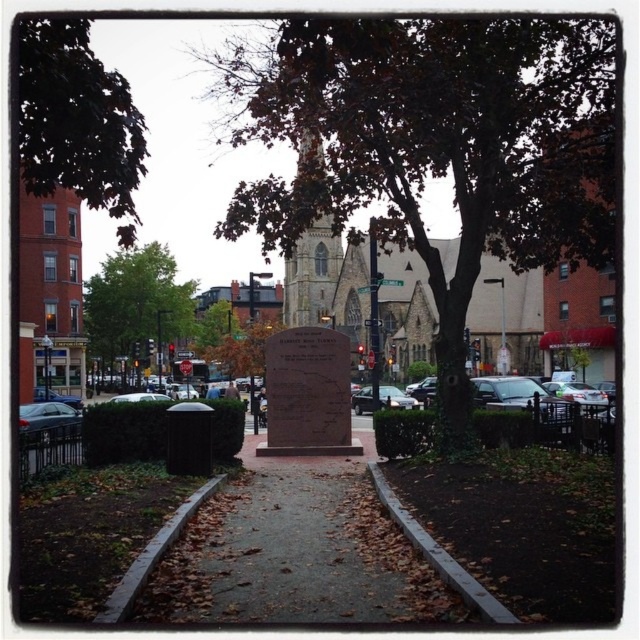
You are standing in the plaza facing the stone monument. To your left, you see the brown brick church at left, and to your right, the silver metallic sedan at right. If you turn around completely, which direction will each object be relative to you?

After turning around completely, the brown brick church at left will be to your right and the silver metallic sedan at right will be to your left. This is because when you turn 180 degrees, your left and right directions reverse. Since the brown brick church at left was originally to your left, it will now be on your right. Similarly, the silver metallic sedan at right, which was on your right, will now be on your left.

You are standing in the plaza and want to take a photo of both the brown textured tree at center and the brown stone church at center. Which object should you position closer to the camera to ensure both are fully visible in the frame?

You should position the brown stone church at center closer to the camera because it is shorter than the brown textured tree at center, allowing both to fit within the frame without one blocking the other.

Based on the scene description, which object is located at the coordinates point (435, 147)?

The point (435, 147) corresponds to the brown textured tree at center.